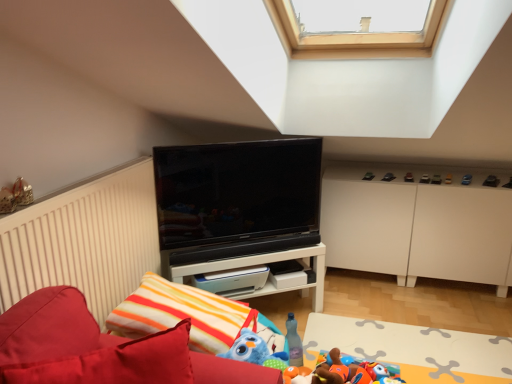
Locate an element on the screen. The height and width of the screenshot is (384, 512). metallic silver toy car at right, which is the 3th toy from right to left is located at coordinates (448, 179).

Measure the distance between point (439,182) and camera.

The distance of point (439,182) from camera is 8.83 feet.

Where is `blue plastic toy at upper right, which ranks as the 4th toy in front-to-back order`? This screenshot has height=384, width=512. blue plastic toy at upper right, which ranks as the 4th toy in front-to-back order is located at coordinates click(x=466, y=179).

Image resolution: width=512 pixels, height=384 pixels. I want to click on velvet red sofa at lower left, so click(103, 349).

Find the location of `white matte cabinet at right`. white matte cabinet at right is located at coordinates (417, 225).

Is white glossy shelf at center far from metallic gold ornament at upper left, which is counted as the 7th toy, starting from the top?

Yes, white glossy shelf at center and metallic gold ornament at upper left, which is counted as the 7th toy, starting from the top, are located far from each other.

Which is more to the left, white glossy shelf at center or metallic gold ornament at upper left, which ranks as the first toy in left-to-right order?

Positioned to the left is metallic gold ornament at upper left, which ranks as the first toy in left-to-right order.

Could you tell me if white glossy shelf at center is facing metallic gold ornament at upper left, which is counted as the 7th toy, starting from the top?

No, white glossy shelf at center is not facing towards metallic gold ornament at upper left, which is counted as the 7th toy, starting from the top.

Can you confirm if white glossy shelf at center is thinner than metallic gold ornament at upper left, which is the 2th toy in bottom-to-top order?

No, white glossy shelf at center is not thinner than metallic gold ornament at upper left, which is the 2th toy in bottom-to-top order.

How different are the orientations of metallic silver toy car at right, the 4th toy in the top-to-bottom sequence, and smooth plastic toy car at right, which is the fifth toy in right-to-left order, in degrees?

They differ by 2.63 degrees in their facing directions.

From a real-world perspective, is metallic silver toy car at right, which is the 3th toy from right to left, located higher than smooth plastic toy car at right, which appears as the seventh toy when viewed from the front?

Yes.

Who is taller, metallic silver toy car at right, marked as the 5th toy in a bottom-to-top arrangement, or smooth plastic toy car at right, arranged as the 2th toy when viewed from the back?

metallic silver toy car at right, marked as the 5th toy in a bottom-to-top arrangement.

Relative to smooth plastic toy car at right, which appears as the seventh toy when viewed from the front, is metallic silver toy car at right, which appears as the 6th toy when viewed from the left, in front or behind?

metallic silver toy car at right, which appears as the 6th toy when viewed from the left, is positioned closer to the viewer than smooth plastic toy car at right, which appears as the seventh toy when viewed from the front.

Considering the positions of objects striped fabric pillow at lower center and velvet red sofa at lower left in the image provided, who is more to the right, striped fabric pillow at lower center or velvet red sofa at lower left?

From the viewer's perspective, striped fabric pillow at lower center appears more on the right side.

Does striped fabric pillow at lower center turn towards velvet red sofa at lower left?

No, striped fabric pillow at lower center is not facing towards velvet red sofa at lower left.

Is point (165, 310) closer to viewer compared to point (218, 380)?

That is False.

Is striped fabric pillow at lower center located outside velvet red sofa at lower left?

Yes, striped fabric pillow at lower center is located beyond the bounds of velvet red sofa at lower left.

From the image's perspective, which one is positioned higher, black glossy tv at center or white glossy shelf at center?

black glossy tv at center.

From the picture: How many degrees apart are the facing directions of black glossy tv at center and white glossy shelf at center?

0.495 degrees separate the facing orientations of black glossy tv at center and white glossy shelf at center.

Based on their sizes in the image, would you say black glossy tv at center is bigger or smaller than white glossy shelf at center?

Considering their sizes, black glossy tv at center takes up less space than white glossy shelf at center.

Based on the photo, from a real-world perspective, who is located lower, plush orange toy at lower right, arranged as the 8th toy when viewed from the top, or matte black toy at upper center, the 8th toy from the bottom?

plush orange toy at lower right, arranged as the 8th toy when viewed from the top, is physically lower.

Can you confirm if plush orange toy at lower right, which is the first toy in bottom-to-top order, is positioned to the right of matte black toy at upper center, the 8th toy from the bottom?

In fact, plush orange toy at lower right, which is the first toy in bottom-to-top order, is to the left of matte black toy at upper center, the 8th toy from the bottom.

Can you tell me how much plush orange toy at lower right, which is the first toy in bottom-to-top order, and matte black toy at upper center, the 1th toy in the back-to-front sequence, differ in facing direction?

111 degrees.

From the picture: Which object is positioned more to the left, metallic black toy car at upper right, which is counted as the sixth toy, starting from the top, or metallic silver toy car at right, which appears as the 3th toy when viewed from the back?

From the viewer's perspective, metallic silver toy car at right, which appears as the 3th toy when viewed from the back, appears more on the left side.

Is metallic black toy car at upper right, which is the 6th toy in back-to-front order, positioned with its back to metallic silver toy car at right, the 4th toy in the top-to-bottom sequence?

metallic black toy car at upper right, which is the 6th toy in back-to-front order, does not have its back to metallic silver toy car at right, the 4th toy in the top-to-bottom sequence.

What's the angular difference between metallic black toy car at upper right, the 8th toy when ordered from left to right, and metallic silver toy car at right, marked as the 5th toy in a bottom-to-top arrangement,'s facing directions?

The angle between the facing direction of metallic black toy car at upper right, the 8th toy when ordered from left to right, and the facing direction of metallic silver toy car at right, marked as the 5th toy in a bottom-to-top arrangement, is 8.71 degrees.

Looking at this image, is matte black toy at upper center, which is the third toy in left-to-right order, aimed at velvet red sofa at lower left?

Yes, matte black toy at upper center, which is the third toy in left-to-right order, faces towards velvet red sofa at lower left.

Would you say matte black toy at upper center, the 1th toy in the top-to-bottom sequence, contains velvet red sofa at lower left?

No, velvet red sofa at lower left is not inside matte black toy at upper center, the 1th toy in the top-to-bottom sequence.

From the image's perspective, who appears lower, matte black toy at upper center, acting as the 6th toy starting from the right, or velvet red sofa at lower left?

velvet red sofa at lower left, from the image's perspective.

The image size is (512, 384). What are the coordinates of `toy that is the 4th one above the velvet red sofa at lower left (from a real-world perspective)` in the screenshot? It's located at (409, 177).

The height and width of the screenshot is (384, 512). What are the coordinates of `shelf located below the metallic gold ornament at upper left, placed as the eighth toy when sorted from back to front (from the image's perspective)` in the screenshot? It's located at (262, 264).

This screenshot has width=512, height=384. I want to click on toy that is the 2nd object to the left of the metallic silver toy car at right, which appears as the 6th toy when viewed from the left, starting at the anchor, so click(425, 179).

Estimate the real-world distances between objects in this image. Which object is closer to metallic gold ornament at upper left, which is the 2th toy in bottom-to-top order, blue plastic toy at upper right, the second toy viewed from the right, or black glossy tv at center?

black glossy tv at center lies closer to metallic gold ornament at upper left, which is the 2th toy in bottom-to-top order, than the other object.

From the image, which object appears to be nearer to metallic black toy car at upper right, the 8th toy when ordered from left to right, soft plush toys at lower right or white matte cabinet at right?

white matte cabinet at right is positioned closer to the anchor metallic black toy car at upper right, the 8th toy when ordered from left to right.

Based on their spatial positions, is soft plush toys at lower right or matte black toy at upper center, acting as the 6th toy starting from the right, further from black glossy tv at center?

The object further to black glossy tv at center is matte black toy at upper center, acting as the 6th toy starting from the right.

Based on the photo, when comparing their distances from black glossy tv at center, does soft plush toys at lower right or plush orange toy at lower right, arranged as the 8th toy when viewed from the top, seem further?

Among the two, plush orange toy at lower right, arranged as the 8th toy when viewed from the top, is located further to black glossy tv at center.

When comparing their distances from metallic silver toy at upper right, which is the second toy from top to bottom, does soft plush toys at lower right or smooth plastic toy car at right, arranged as the 2th toy when viewed from the back, seem further?

Among the two, soft plush toys at lower right is located further to metallic silver toy at upper right, which is the second toy from top to bottom.

Considering their positions, is metallic black toy car at upper right, the 3th toy from the bottom, positioned further to metallic gold ornament at upper left, positioned as the first toy in front-to-back order, than striped fabric pillow at lower center?

Among the two, metallic black toy car at upper right, the 3th toy from the bottom, is located further to metallic gold ornament at upper left, positioned as the first toy in front-to-back order.

In the scene shown: From the image, which object appears to be farther from velvet red sofa at lower left, white glossy shelf at center or matte black toy at upper center, marked as the 8th toy in a front-to-back arrangement?

matte black toy at upper center, marked as the 8th toy in a front-to-back arrangement, is further to velvet red sofa at lower left.

From the image, which object appears to be nearer to blue plastic toy at upper right, the 4th toy ordered from the bottom, smooth plastic toy car at right, which appears as the seventh toy when viewed from the front, or metallic gold ornament at upper left, which is counted as the eighth toy, starting from the right?

Based on the image, smooth plastic toy car at right, which appears as the seventh toy when viewed from the front, appears to be nearer to blue plastic toy at upper right, the 4th toy ordered from the bottom.

Find the location of a particular element. cabinetry situated between white glossy shelf at center and metallic silver toy car at right, the 4th toy in the top-to-bottom sequence, from left to right is located at coordinates tap(417, 225).

Identify the location of television between striped fabric pillow at lower center and soft plush toys at lower right. This screenshot has height=384, width=512. (237, 198).

I want to click on plain between white glossy shelf at center and metallic silver toy car at right, which appears as the 6th toy when viewed from the left, in the horizontal direction, so click(413, 349).

Locate an element on the screen. Image resolution: width=512 pixels, height=384 pixels. television between metallic gold ornament at upper left, which ranks as the first toy in left-to-right order, and white matte cabinet at right, in the horizontal direction is located at coordinates click(x=237, y=198).